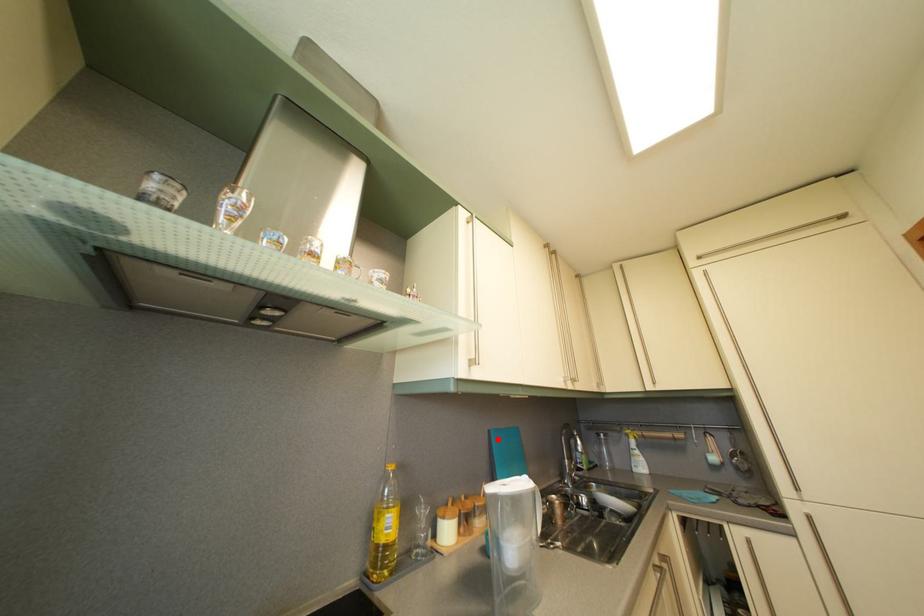
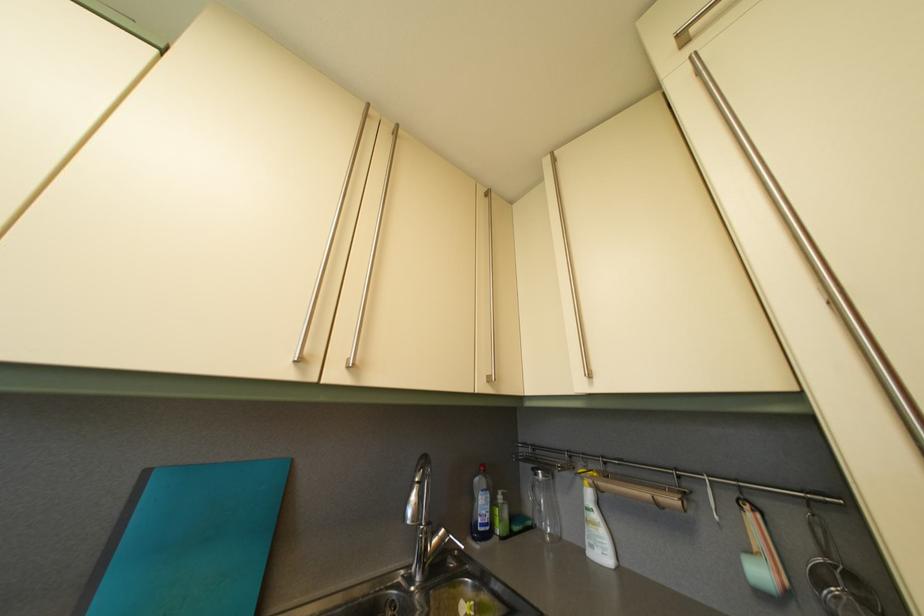
Question: I am providing you with two images of the same scene from different viewpoints. Given a red point in image1, look at the same physical point in image2. Is it:

Choices:
 (A) Closer to the viewpoint
 (B) Farther from the viewpoint

Answer: (A)